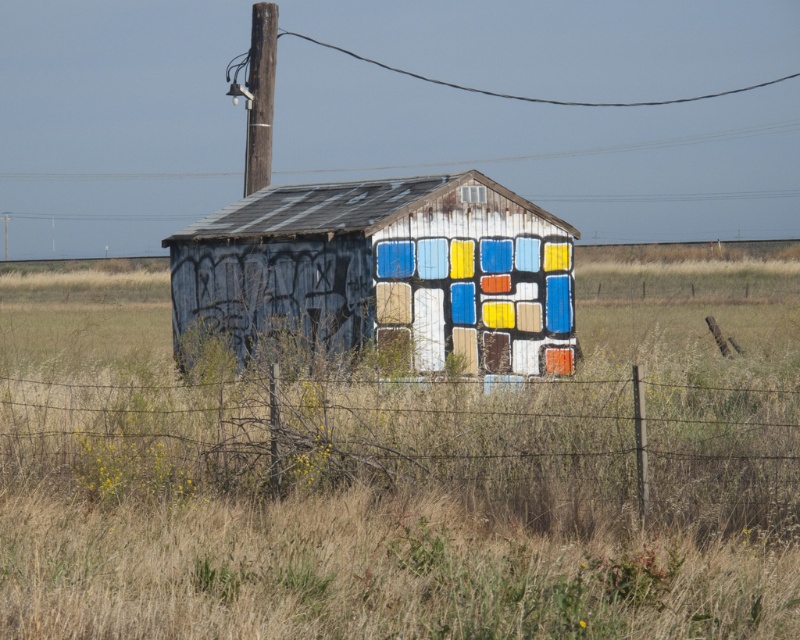
Question: Which of the following is the closest to the observer?

Choices:
 (A) [x=270, y=157]
 (B) [x=476, y=189]
 (C) [x=492, y=193]
 (D) [x=602, y=106]

Answer: (B)

Question: Can you confirm if painted wood hut at center is thinner than black wire at upper center?

Choices:
 (A) yes
 (B) no

Answer: (A)

Question: Which point is closer to the camera taking this photo?

Choices:
 (A) (474, 192)
 (B) (690, 100)

Answer: (A)

Question: Can you confirm if brown wooden telegraph pole at upper center is positioned above black wire at upper center?

Choices:
 (A) no
 (B) yes

Answer: (A)

Question: Which point is farther from the camera taking this photo?

Choices:
 (A) (464, 200)
 (B) (254, 26)
 (C) (742, 493)

Answer: (B)

Question: Is painted wood hut at center bigger than brown wooden telegraph pole at upper center?

Choices:
 (A) no
 (B) yes

Answer: (A)